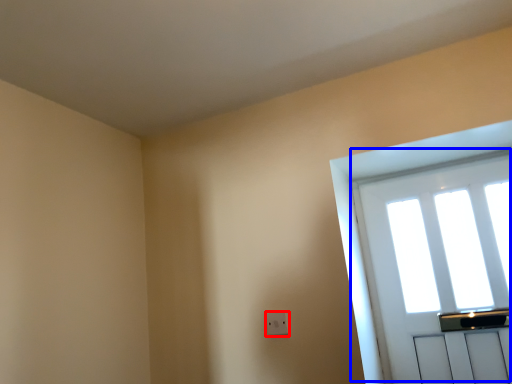
Question: Which object is further to the camera taking this photo, electric outlet (highlighted by a red box) or window (highlighted by a blue box)?

Choices:
 (A) electric outlet
 (B) window

Answer: (A)